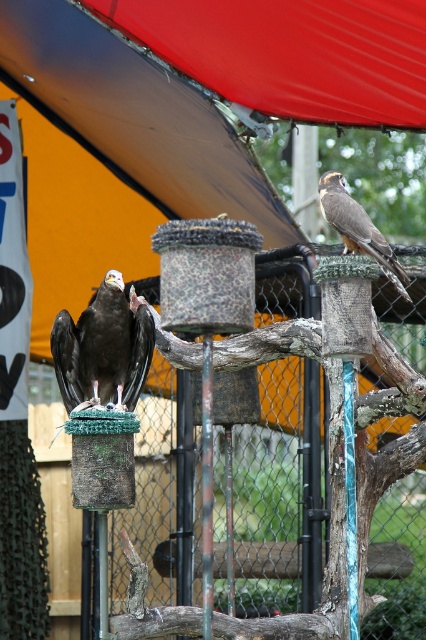
From the picture: You are a birdwatcher observing the aviary. You notice two birds in the enclosure. The first bird is the dark brown feathers at center, and the second is the brown feathered eagle at upper right. Which of these two birds is taller?

The dark brown feathers at center is much taller than the brown feathered eagle at upper right according to the description provided.

You are a zookeeper observing the aviary and notice two birds. You see the dark brown feathers at center and the brown feathered eagle at upper right. Which bird is positioned to the left of the other?

The dark brown feathers at center is positioned to the left of the brown feathered eagle at upper right.

You are a birdwatcher trying to observe both the dark brown feathers at center and the brown feathered eagle at upper right. Which bird is closer to you?

The dark brown feathers at center is closer to you because the brown feathered eagle at upper right is positioned behind it.